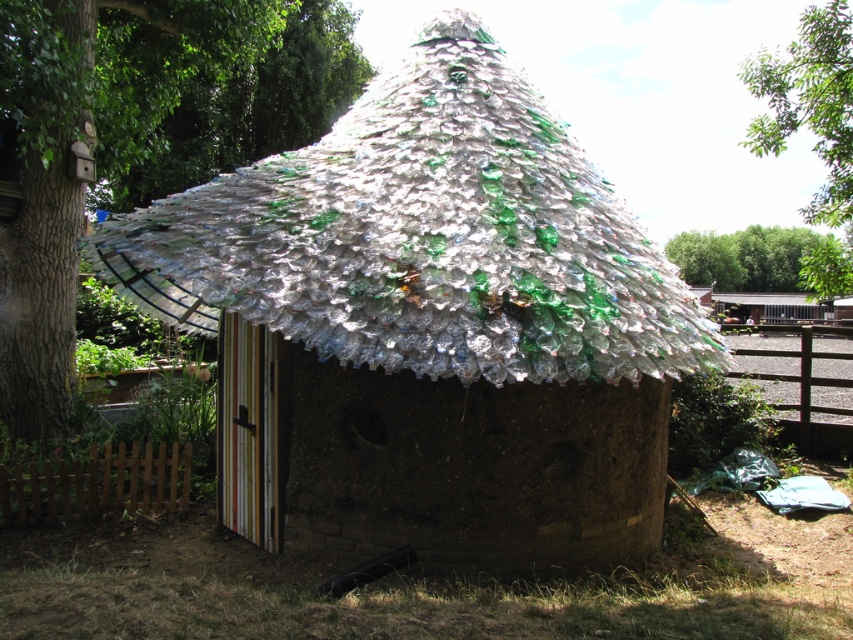
Does translucent plastic bottles at center lie behind green glass tree at upper center?

No, translucent plastic bottles at center is closer to the viewer.

Does translucent plastic bottles at center have a lesser height compared to green glass tree at upper center?

No.

Is point (10, 134) less distant than point (747, 244)?

Yes, point (10, 134) is closer to viewer.

At what (x,y) coordinates should I click in order to perform the action: click on translucent plastic bottles at center. Please return your answer as a coordinate pair (x, y). Looking at the image, I should click on (132, 138).

Who is positioned more to the left, translucent plastic bottles at upper center or green leafy tree at upper right?

translucent plastic bottles at upper center is more to the left.

Does translucent plastic bottles at upper center appear over green leafy tree at upper right?

No.

Does point (171, 148) come farther from viewer compared to point (843, 19)?

Yes, point (171, 148) is farther from viewer.

Locate an element on the screen. translucent plastic bottles at upper center is located at coordinates pyautogui.click(x=251, y=108).

Can you confirm if translucent plastic bottles at center is smaller than green leafy tree at upper right?

Yes, translucent plastic bottles at center is smaller than green leafy tree at upper right.

Is translucent plastic bottles at center shorter than green leafy tree at upper right?

Incorrect, translucent plastic bottles at center's height does not fall short of green leafy tree at upper right's.

Is point (143, 60) closer to viewer compared to point (827, 120)?

No, (143, 60) is further to viewer.

Locate an element on the screen. translucent plastic bottles at center is located at coordinates (132, 138).